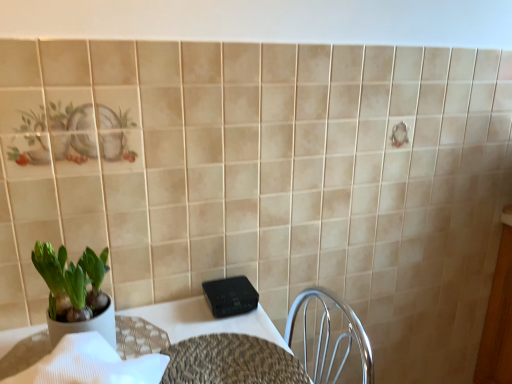
Question: From the image's perspective, is green matte pot at left below leather textured table at lower left?

Choices:
 (A) no
 (B) yes

Answer: (A)

Question: Considering the relative sizes of green matte pot at left and leather textured table at lower left in the image provided, is green matte pot at left thinner than leather textured table at lower left?

Choices:
 (A) yes
 (B) no

Answer: (A)

Question: Can you confirm if green matte pot at left is wider than leather textured table at lower left?

Choices:
 (A) yes
 (B) no

Answer: (B)

Question: Considering the relative sizes of green matte pot at left and leather textured table at lower left in the image provided, is green matte pot at left smaller than leather textured table at lower left?

Choices:
 (A) no
 (B) yes

Answer: (B)

Question: Does green matte pot at left touch leather textured table at lower left?

Choices:
 (A) no
 (B) yes

Answer: (A)

Question: In the image, is green matte pot at left positioned in front of or behind leather textured table at lower left?

Choices:
 (A) behind
 (B) front

Answer: (A)

Question: Considering the positions of green matte pot at left and leather textured table at lower left in the image, is green matte pot at left taller or shorter than leather textured table at lower left?

Choices:
 (A) short
 (B) tall

Answer: (B)

Question: Considering the positions of green matte pot at left and leather textured table at lower left in the image, is green matte pot at left wider or thinner than leather textured table at lower left?

Choices:
 (A) wide
 (B) thin

Answer: (B)

Question: Is point (68, 314) closer or farther from the camera than point (150, 329)?

Choices:
 (A) farther
 (B) closer

Answer: (B)

Question: Does point (143, 337) appear closer or farther from the camera than point (62, 268)?

Choices:
 (A) closer
 (B) farther

Answer: (B)

Question: Do you think leather textured table at lower left is within green matte pot at left, or outside of it?

Choices:
 (A) inside
 (B) outside

Answer: (B)

Question: From a real-world perspective, relative to green matte pot at left, is leather textured table at lower left vertically above or below?

Choices:
 (A) above
 (B) below

Answer: (B)

Question: Is leather textured table at lower left bigger or smaller than green matte pot at left?

Choices:
 (A) small
 (B) big

Answer: (B)

Question: Is leopard print table at center situated inside green matte pot at left or outside?

Choices:
 (A) outside
 (B) inside

Answer: (A)

Question: Would you say leopard print table at center is to the left or to the right of green matte pot at left in the picture?

Choices:
 (A) right
 (B) left

Answer: (A)